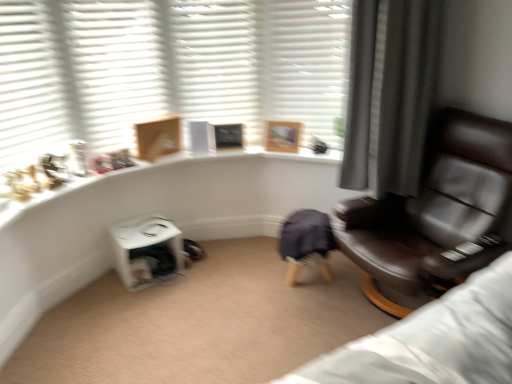
Find the location of `vacant area to the left of wooden picture frame at upper center`. vacant area to the left of wooden picture frame at upper center is located at coordinates (259, 148).